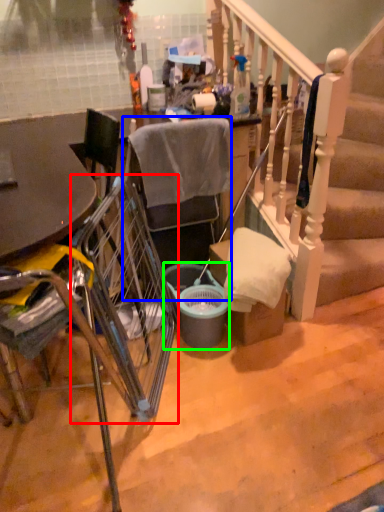
Question: Which is nearer to the trolley (highlighted by a red box)? chair (highlighted by a blue box) or bucket (highlighted by a green box).

Choices:
 (A) chair
 (B) bucket

Answer: (B)